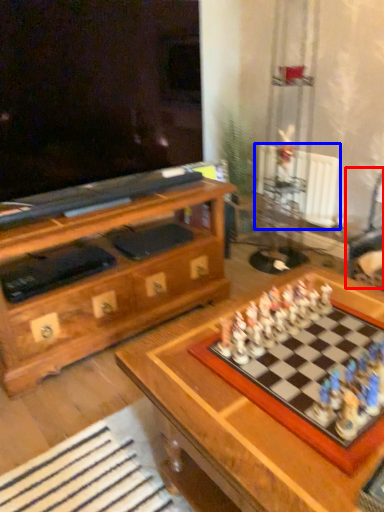
Question: Which point is closer to the camera, swivel chair (highlighted by a red box) or radiator (highlighted by a blue box)?

Choices:
 (A) swivel chair
 (B) radiator

Answer: (A)